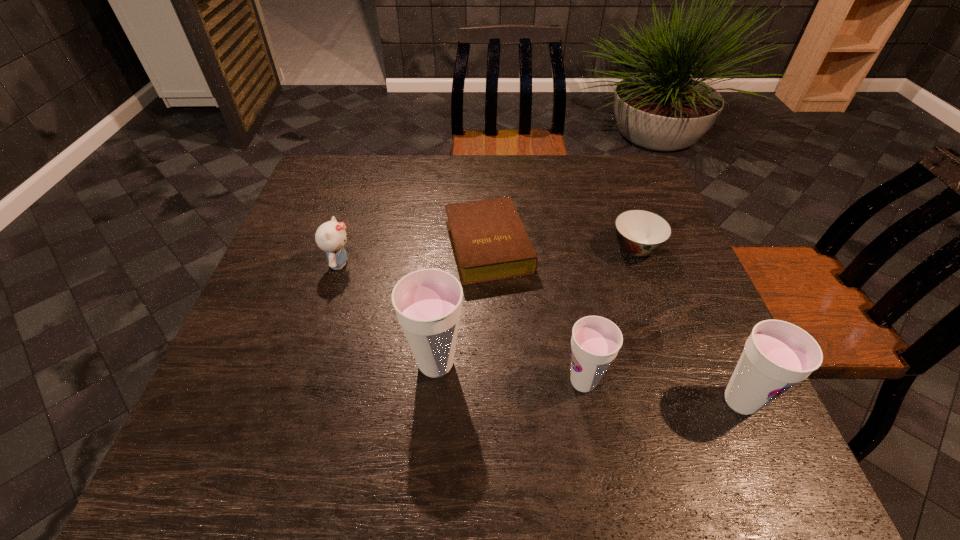
Find the location of a particular element. The width and height of the screenshot is (960, 540). vacant space at the left edge of the desktop is located at coordinates (304, 231).

In the image, there is a desktop. In order to click on free space at the right edge in this screenshot , I will do `click(704, 359)`.

Image resolution: width=960 pixels, height=540 pixels. What are the coordinates of `vacant space at the far left corner of the desktop` in the screenshot? It's located at coord(316,194).

Locate an element on the screen. This screenshot has height=540, width=960. free location at the near left corner of the desktop is located at coordinates (250, 393).

You are a GUI agent. You are given a task and a screenshot of the screen. Output one action in this format:
    pyautogui.click(x=<x>, y=<y>)
    Task: Click on the vacant space at the far right corner of the desktop
    The height and width of the screenshot is (540, 960).
    Given the screenshot: What is the action you would take?
    pyautogui.click(x=613, y=185)

This screenshot has width=960, height=540. In order to click on empty space between the Bible and the second shortest object in this screenshot , I will do `click(562, 248)`.

The height and width of the screenshot is (540, 960). Find the location of `free space between the rightmost cup and the leftmost object`. free space between the rightmost cup and the leftmost object is located at coordinates (540, 332).

Identify the location of empty location between the rightmost cup and the soup bowl. (688, 325).

Find the location of a particular element. empty space between the second shortest cup and the soup bowl is located at coordinates (688, 325).

You are a GUI agent. You are given a task and a screenshot of the screen. Output one action in this format:
    pyautogui.click(x=<x>, y=<y>)
    Task: Click on the unoccupied position between the leftmost object and the second cup from left to right
    The height and width of the screenshot is (540, 960).
    Given the screenshot: What is the action you would take?
    pyautogui.click(x=462, y=322)